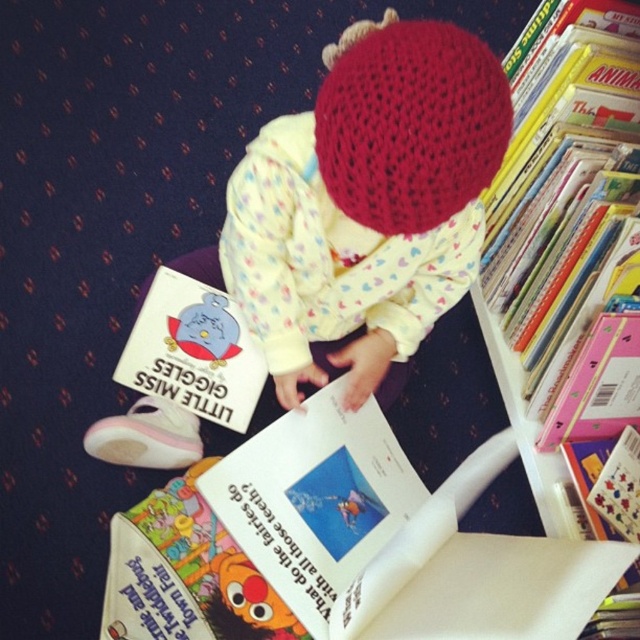
Question: Which object is closer to the camera taking this photo?

Choices:
 (A) knitted wool hat at center
 (B) white plastic bookshelf at upper right

Answer: (A)

Question: Is knitted wool hat at center to the left of white plastic bookshelf at upper right from the viewer's perspective?

Choices:
 (A) yes
 (B) no

Answer: (A)

Question: Which of the following is the farthest from the observer?

Choices:
 (A) white plastic bookshelf at upper right
 (B) knitted wool hat at center

Answer: (A)

Question: Is knitted wool hat at center in front of white plastic bookshelf at upper right?

Choices:
 (A) no
 (B) yes

Answer: (B)

Question: Is knitted wool hat at center to the right of white plastic bookshelf at upper right from the viewer's perspective?

Choices:
 (A) no
 (B) yes

Answer: (A)